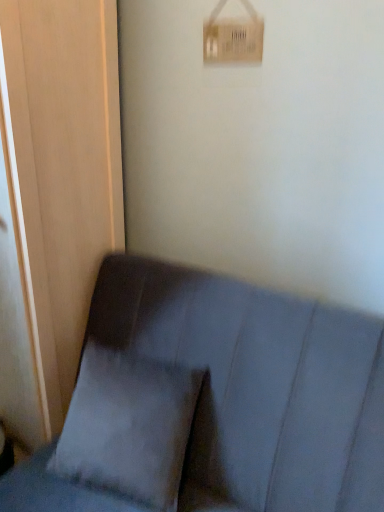
Question: Considering the positions of suede gray couch at lower left and matte wood screen door at left in the image, is suede gray couch at lower left wider or thinner than matte wood screen door at left?

Choices:
 (A) thin
 (B) wide

Answer: (B)

Question: In terms of height, does suede gray couch at lower left look taller or shorter compared to matte wood screen door at left?

Choices:
 (A) tall
 (B) short

Answer: (B)

Question: Which object is positioned farthest from the white cardboard light switch at upper center?

Choices:
 (A) matte wood screen door at left
 (B) gray fabric pillow at lower left
 (C) suede gray couch at lower left

Answer: (B)

Question: Which of these objects is positioned farthest from the white cardboard light switch at upper center?

Choices:
 (A) matte wood screen door at left
 (B) gray fabric pillow at lower left
 (C) suede gray couch at lower left

Answer: (B)